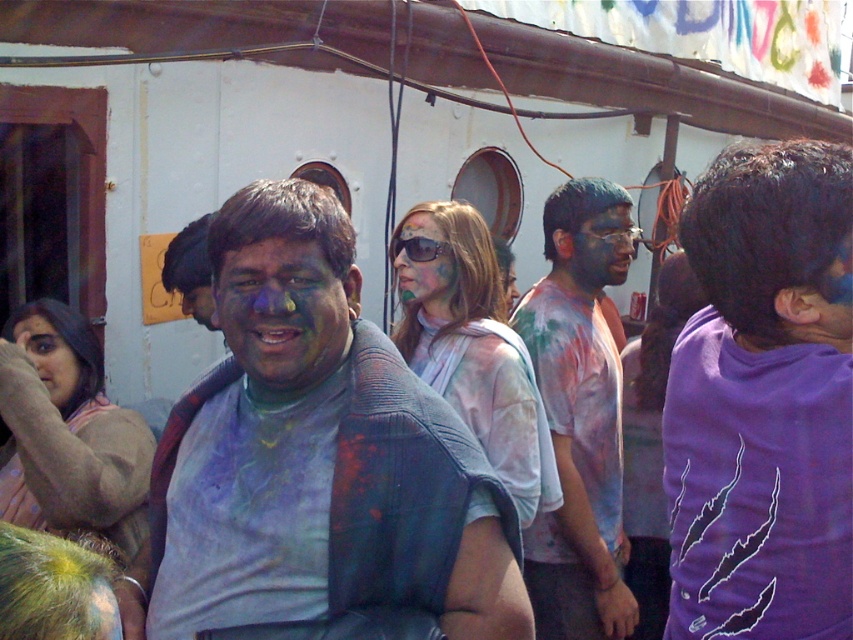
Question: Which point is closer to the camera?

Choices:
 (A) (276, 348)
 (B) (283, 332)
 (C) (506, 292)

Answer: (A)

Question: Estimate the real-world distances between objects in this image. Which object is farther from the matte paint face at center?

Choices:
 (A) matte blue shirt at center
 (B) matte skin at center

Answer: (B)

Question: Can you confirm if multicolored paint-covered shirt at center is positioned below matte plastic sunglasses at center?

Choices:
 (A) yes
 (B) no

Answer: (A)

Question: Is multicolored paint-covered shirt at center to the left of matte blue face at center from the viewer's perspective?

Choices:
 (A) no
 (B) yes

Answer: (B)

Question: Which is nearer to the matte blue face at center?

Choices:
 (A) matte skin face at center
 (B) matte skin at center

Answer: (A)

Question: Does matte blue face at center appear on the right side of matte painted face at center?

Choices:
 (A) no
 (B) yes

Answer: (B)